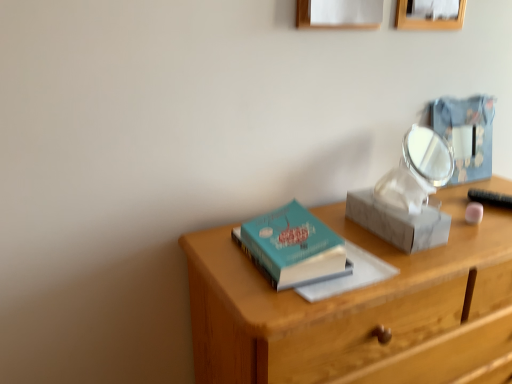
In order to click on white marble shoe box at center-right in this screenshot , I will do `click(399, 221)`.

Image resolution: width=512 pixels, height=384 pixels. What do you see at coordinates (466, 134) in the screenshot?
I see `metallic blue box at upper right` at bounding box center [466, 134].

What is the approximate width of white paper at upper center, marked as the first picture frame in a left-to-right arrangement?

white paper at upper center, marked as the first picture frame in a left-to-right arrangement, is 1.89 inches wide.

I want to click on wooden picture frame at upper center, the 2th picture frame viewed from the left, so click(x=426, y=19).

Where is `teal matte hardcover book at center`? The image size is (512, 384). teal matte hardcover book at center is located at coordinates (293, 247).

This screenshot has height=384, width=512. What do you see at coordinates (356, 309) in the screenshot?
I see `wooden desk at center` at bounding box center [356, 309].

Identify the location of white marble shoe box at center-right. (399, 221).

Is wooden picture frame at upper center, the 2th picture frame viewed from the left, not near wooden desk at center?

wooden picture frame at upper center, the 2th picture frame viewed from the left, is near wooden desk at center, not far away.

Between point (408, 17) and point (231, 377), which one is positioned in front?

The point (231, 377) is more forward.

Who is bigger, wooden picture frame at upper center, the 2th picture frame viewed from the left, or wooden desk at center?

With larger size is wooden desk at center.

Is wooden picture frame at upper center, marked as the first picture frame in a right-to-left arrangement, completely or partially outside of wooden desk at center?

That's correct, wooden picture frame at upper center, marked as the first picture frame in a right-to-left arrangement, is outside of wooden desk at center.

Looking at this image, which object is closer to the camera, metallic blue box at upper right or teal matte hardcover book at center?

teal matte hardcover book at center is closer to the camera.

Looking at this image, is metallic blue box at upper right oriented away from teal matte hardcover book at center?

No, metallic blue box at upper right is not facing the opposite direction of teal matte hardcover book at center.

Is metallic blue box at upper right positioned far away from teal matte hardcover book at center?

No, metallic blue box at upper right is in close proximity to teal matte hardcover book at center.

Can teal matte hardcover book at center be found inside metallic blue box at upper right?

No, teal matte hardcover book at center is not inside metallic blue box at upper right.

Looking at the image, does wooden picture frame at upper center, the 2th picture frame viewed from the left, seem bigger or smaller compared to white marble shoe box at center-right?

wooden picture frame at upper center, the 2th picture frame viewed from the left, is smaller than white marble shoe box at center-right.

Does wooden picture frame at upper center, the 2th picture frame viewed from the left, come behind white marble shoe box at center-right?

Yes, wooden picture frame at upper center, the 2th picture frame viewed from the left, is further from the camera.

From a real-world perspective, which object rests below the other?

From a 3D spatial view, white marble shoe box at center-right is below.

Are wooden picture frame at upper center, marked as the first picture frame in a right-to-left arrangement, and white marble shoe box at center-right beside each other?

wooden picture frame at upper center, marked as the first picture frame in a right-to-left arrangement, and white marble shoe box at center-right are clearly separated.

Which object is closer to the camera taking this photo, white paper at upper center, marked as the first picture frame in a left-to-right arrangement, or white marble shoe box at center-right?

white paper at upper center, marked as the first picture frame in a left-to-right arrangement, is in front.

Consider the image. Does white paper at upper center, marked as the first picture frame in a left-to-right arrangement, have a larger size compared to white marble shoe box at center-right?

No.

Considering the sizes of objects white paper at upper center, marked as the first picture frame in a left-to-right arrangement, and white marble shoe box at center-right in the image provided, who is taller, white paper at upper center, marked as the first picture frame in a left-to-right arrangement, or white marble shoe box at center-right?

white paper at upper center, marked as the first picture frame in a left-to-right arrangement.

Is white paper at upper center, marked as the first picture frame in a left-to-right arrangement, positioned with its back to white marble shoe box at center-right?

No, white marble shoe box at center-right is not at the back of white paper at upper center, marked as the first picture frame in a left-to-right arrangement.

Is point (478, 130) closer to camera compared to point (331, 220)?

No, it is not.

Considering the relative sizes of metallic blue box at upper right and wooden desk at center in the image provided, is metallic blue box at upper right shorter than wooden desk at center?

Correct, metallic blue box at upper right is not as tall as wooden desk at center.

Is metallic blue box at upper right wider than wooden desk at center?

Incorrect, the width of metallic blue box at upper right does not surpass that of wooden desk at center.

Is metallic blue box at upper right positioned behind wooden desk at center?

Yes, it is.

Is white marble shoe box at center-right located outside metallic blue box at upper right?

white marble shoe box at center-right is positioned outside metallic blue box at upper right.

Is white marble shoe box at center-right positioned behind metallic blue box at upper right?

No.

Would you say white marble shoe box at center-right is a long distance from metallic blue box at upper right?

They are positioned close to each other.

Between white marble shoe box at center-right and metallic blue box at upper right, which one has larger size?

white marble shoe box at center-right is bigger.

Is white paper at upper center, marked as the first picture frame in a left-to-right arrangement, not within teal matte hardcover book at center?

Indeed, white paper at upper center, marked as the first picture frame in a left-to-right arrangement, is completely outside teal matte hardcover book at center.

From a real-world perspective, does white paper at upper center, which is the second picture frame in right-to-left order, stand above teal matte hardcover book at center?

Yes.

Locate an element on the screen. desk located below the wooden picture frame at upper center, the 2th picture frame viewed from the left (from the image's perspective) is located at coordinates (356, 309).

The width and height of the screenshot is (512, 384). What are the coordinates of `paperback book located underneath the metallic blue box at upper right (from a real-world perspective)` in the screenshot? It's located at (293, 247).

Looking at the image, which one is located further to white paper at upper center, which is the second picture frame in right-to-left order, metallic blue box at upper right or teal matte hardcover book at center?

teal matte hardcover book at center is positioned further to the anchor white paper at upper center, which is the second picture frame in right-to-left order.

Estimate the real-world distances between objects in this image. Which object is further from wooden desk at center, wooden picture frame at upper center, marked as the first picture frame in a right-to-left arrangement, or metallic blue box at upper right?

Among the two, wooden picture frame at upper center, marked as the first picture frame in a right-to-left arrangement, is located further to wooden desk at center.

Looking at the image, which one is located closer to metallic blue box at upper right, white paper at upper center, which is the second picture frame in right-to-left order, or wooden picture frame at upper center, marked as the first picture frame in a right-to-left arrangement?

wooden picture frame at upper center, marked as the first picture frame in a right-to-left arrangement, lies closer to metallic blue box at upper right than the other object.

Estimate the real-world distances between objects in this image. Which object is further from wooden picture frame at upper center, the 2th picture frame viewed from the left, white marble shoe box at center-right or metallic blue box at upper right?

Based on the image, white marble shoe box at center-right appears to be further to wooden picture frame at upper center, the 2th picture frame viewed from the left.

Based on the photo, which object lies nearer to the anchor point metallic blue box at upper right, wooden picture frame at upper center, the 2th picture frame viewed from the left, or white marble shoe box at center-right?

The object closer to metallic blue box at upper right is wooden picture frame at upper center, the 2th picture frame viewed from the left.

When comparing their distances from wooden desk at center, does wooden picture frame at upper center, marked as the first picture frame in a right-to-left arrangement, or teal matte hardcover book at center seem closer?

teal matte hardcover book at center is closer to wooden desk at center.

Considering their positions, is white marble shoe box at center-right positioned closer to teal matte hardcover book at center than metallic blue box at upper right?

white marble shoe box at center-right is closer to teal matte hardcover book at center.

Considering their positions, is white paper at upper center, marked as the first picture frame in a left-to-right arrangement, positioned further to teal matte hardcover book at center than metallic blue box at upper right?

metallic blue box at upper right.

This screenshot has width=512, height=384. Find the location of `picture frame between wooden picture frame at upper center, marked as the first picture frame in a right-to-left arrangement, and metallic blue box at upper right, in the vertical direction`. picture frame between wooden picture frame at upper center, marked as the first picture frame in a right-to-left arrangement, and metallic blue box at upper right, in the vertical direction is located at coordinates (339, 14).

I want to click on shoe box between white paper at upper center, marked as the first picture frame in a left-to-right arrangement, and wooden desk at center vertically, so click(399, 221).

You are a GUI agent. You are given a task and a screenshot of the screen. Output one action in this format:
    pyautogui.click(x=<x>, y=<y>)
    Task: Click on the picture frame between wooden picture frame at upper center, the 2th picture frame viewed from the left, and white marble shoe box at center-right vertically
    The image size is (512, 384).
    Given the screenshot: What is the action you would take?
    pyautogui.click(x=339, y=14)

Image resolution: width=512 pixels, height=384 pixels. Find the location of `box between wooden picture frame at upper center, the 2th picture frame viewed from the left, and wooden desk at center vertically`. box between wooden picture frame at upper center, the 2th picture frame viewed from the left, and wooden desk at center vertically is located at coordinates (466, 134).